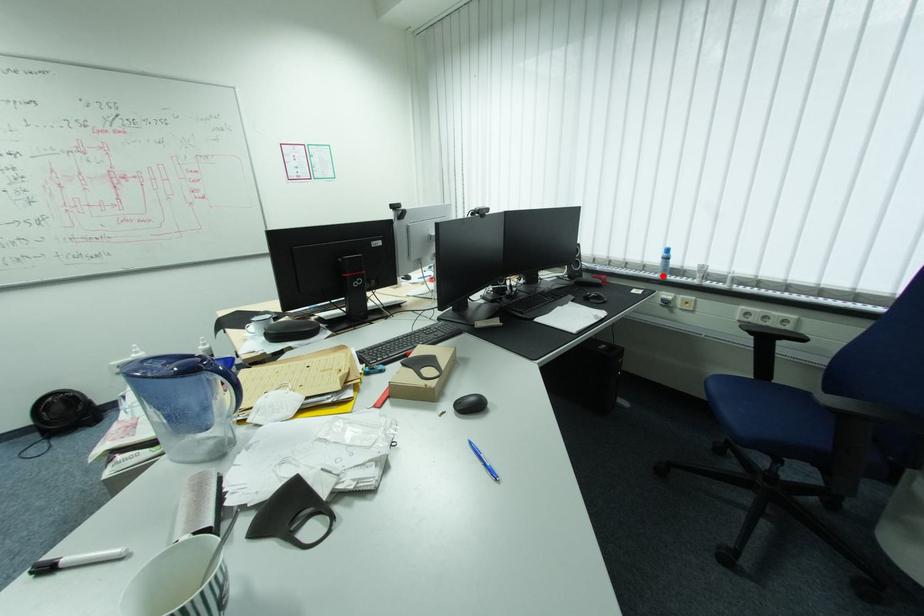
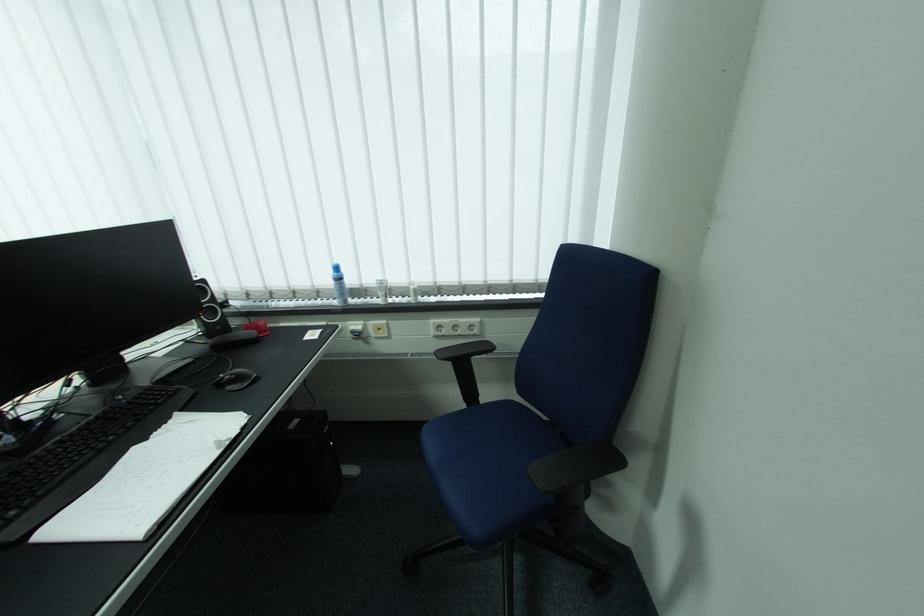
Question: I am providing you with two images of the same scene from different viewpoints. Given a red point in image1, look at the same physical point in image2. Is it:

Choices:
 (A) Closer to the viewpoint
 (B) Farther from the viewpoint

Answer: (B)